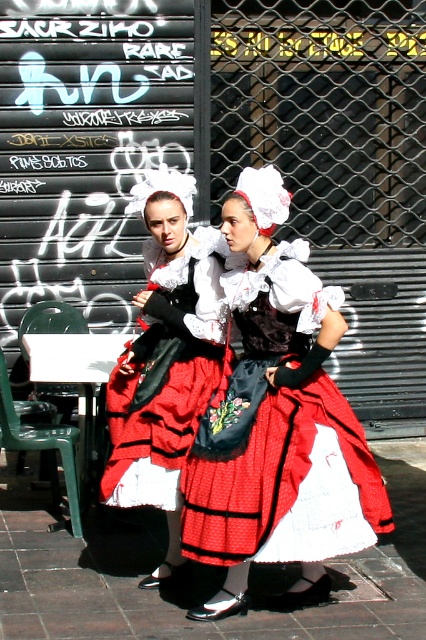
How distant is matte red dress at center from matte black dress at center?

matte red dress at center and matte black dress at center are 17.87 inches apart from each other.

Is matte red dress at center positioned in front of matte black dress at center?

Yes.

You are a GUI agent. You are given a task and a screenshot of the screen. Output one action in this format:
    pyautogui.click(x=<x>, y=<y>)
    Task: Click on the matte red dress at center
    The width and height of the screenshot is (426, 640).
    Given the screenshot: What is the action you would take?
    pyautogui.click(x=278, y=420)

Is smooth brick pavement at center to the right of matte black dress at center from the viewer's perspective?

Indeed, smooth brick pavement at center is positioned on the right side of matte black dress at center.

Is the position of smooth brick pavement at center less distant than that of matte black dress at center?

Yes, it is in front of matte black dress at center.

Image resolution: width=426 pixels, height=640 pixels. I want to click on smooth brick pavement at center, so click(178, 600).

In order to click on smooth brick pavement at center in this screenshot , I will do `click(178, 600)`.

This screenshot has width=426, height=640. What do you see at coordinates (278, 420) in the screenshot?
I see `matte red dress at center` at bounding box center [278, 420].

Between matte red dress at center and smooth brick pavement at center, which one has more height?

matte red dress at center

Identify the location of matte red dress at center. (278, 420).